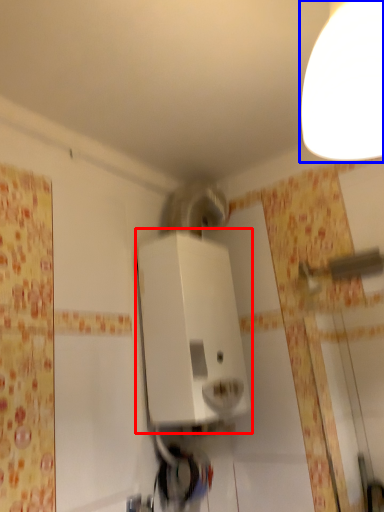
Question: Which of the following is the closest to the observer, appliance (highlighted by a red box) or light fixture (highlighted by a blue box)?

Choices:
 (A) appliance
 (B) light fixture

Answer: (B)